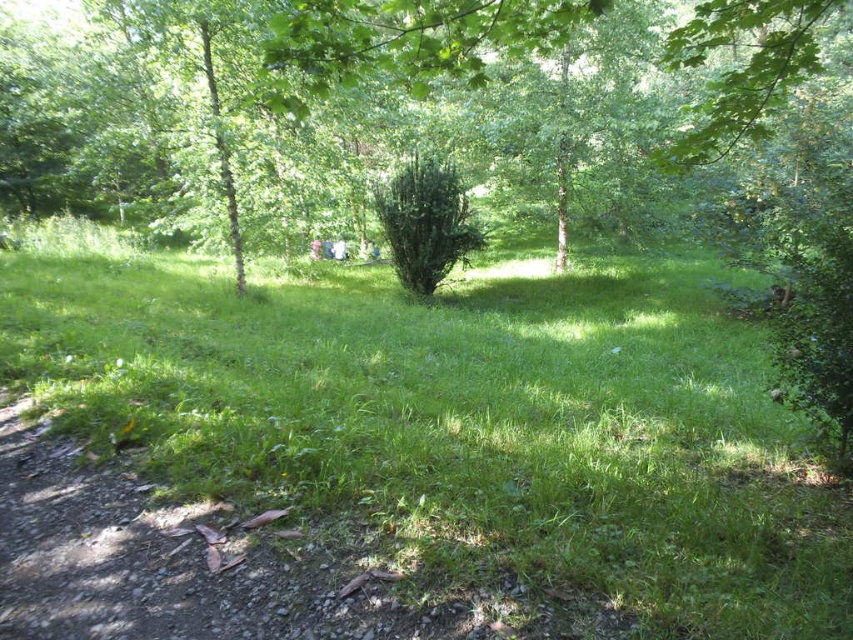
Who is positioned more to the right, green grassy at center or green leafy bush at center?

green leafy bush at center

Who is lower down, green grassy at center or green leafy bush at center?

green grassy at center is below.

You are a GUI agent. You are given a task and a screenshot of the screen. Output one action in this format:
    pyautogui.click(x=<x>, y=<y>)
    Task: Click on the green grassy at center
    
    Given the screenshot: What is the action you would take?
    pyautogui.click(x=457, y=419)